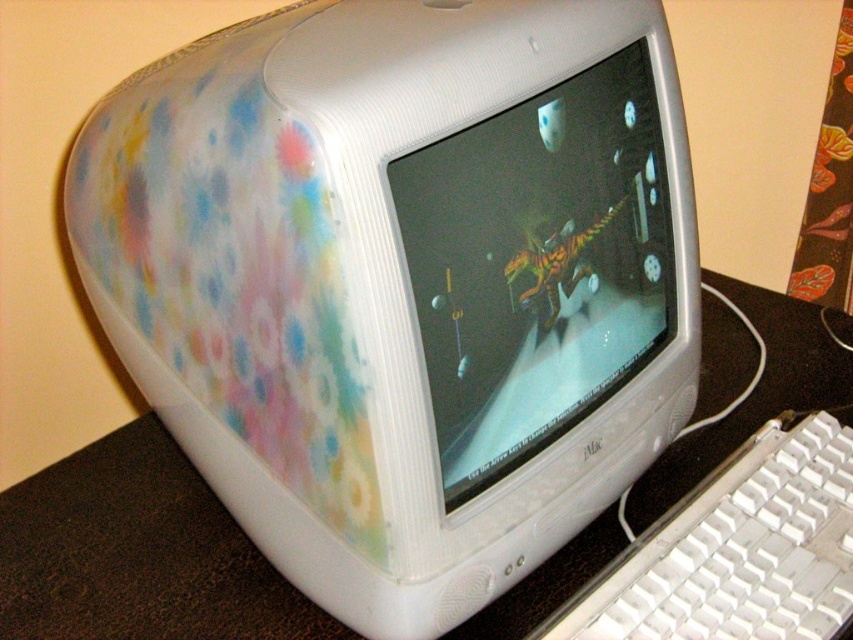
Does white glossy monitor at center appear on the right side of white plastic keyboard at lower right?

No, white glossy monitor at center is not to the right of white plastic keyboard at lower right.

Looking at this image, can you confirm if white glossy monitor at center is positioned to the left of white plastic keyboard at lower right?

Indeed, white glossy monitor at center is positioned on the left side of white plastic keyboard at lower right.

Which is behind, point (465, 227) or point (808, 570)?

Point (808, 570)

The height and width of the screenshot is (640, 853). Identify the location of white glossy monitor at center. (538, 264).

Is white glossy monitor at center to the right of white plastic computer desk at center from the viewer's perspective?

Correct, you'll find white glossy monitor at center to the right of white plastic computer desk at center.

Is white glossy monitor at center wider than white plastic computer desk at center?

In fact, white glossy monitor at center might be narrower than white plastic computer desk at center.

Is point (646, 257) positioned before point (659, 464)?

Yes.

Identify the location of white glossy monitor at center. (538, 264).

Which is in front, point (161, 518) or point (773, 492)?

Point (773, 492) is in front.

From the picture: Does white plastic computer desk at center have a smaller size compared to white plastic keyboard at lower right?

No, white plastic computer desk at center is not smaller than white plastic keyboard at lower right.

Is point (15, 548) more distant than point (660, 636)?

Yes, it is behind point (660, 636).

Identify the location of white plastic computer desk at center. The width and height of the screenshot is (853, 640). (137, 554).